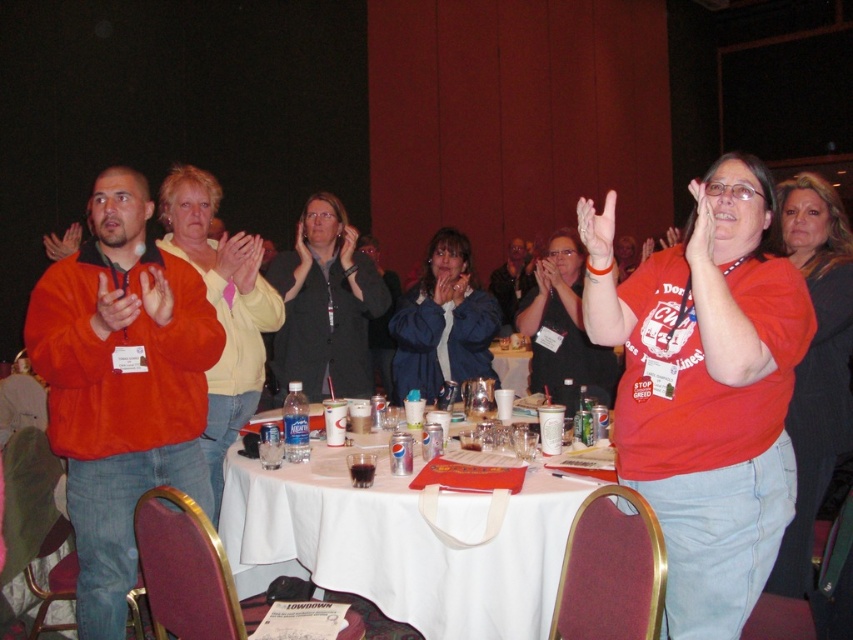
Question: Which of these objects is positioned farthest from the matte black jacket at center?

Choices:
 (A) white cloth-covered table at center
 (B) white paper cup at center
 (C) orange fleece jacket at left

Answer: (C)

Question: Which point appears farthest from the camera in this image?

Choices:
 (A) (334, 316)
 (B) (502, 355)
 (C) (503, 289)

Answer: (C)

Question: Is matte black jacket at center to the left of white paper cup at center from the viewer's perspective?

Choices:
 (A) yes
 (B) no

Answer: (A)

Question: Can you confirm if white cloth-covered table at center is bigger than white paper cup at center?

Choices:
 (A) no
 (B) yes

Answer: (B)

Question: Which point is closer to the camera?

Choices:
 (A) matte black jacket at center
 (B) orange fleece jacket at left

Answer: (B)

Question: Does white cloth-covered table at center have a larger size compared to white paper cup at center?

Choices:
 (A) yes
 (B) no

Answer: (A)